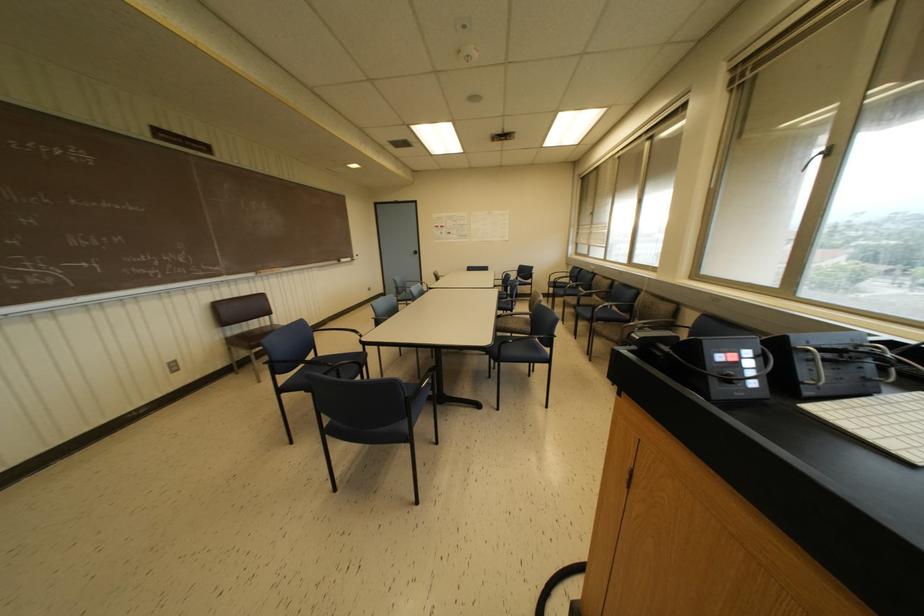
What do you see at coordinates (733, 363) in the screenshot? The image size is (924, 616). I see `a white control knob` at bounding box center [733, 363].